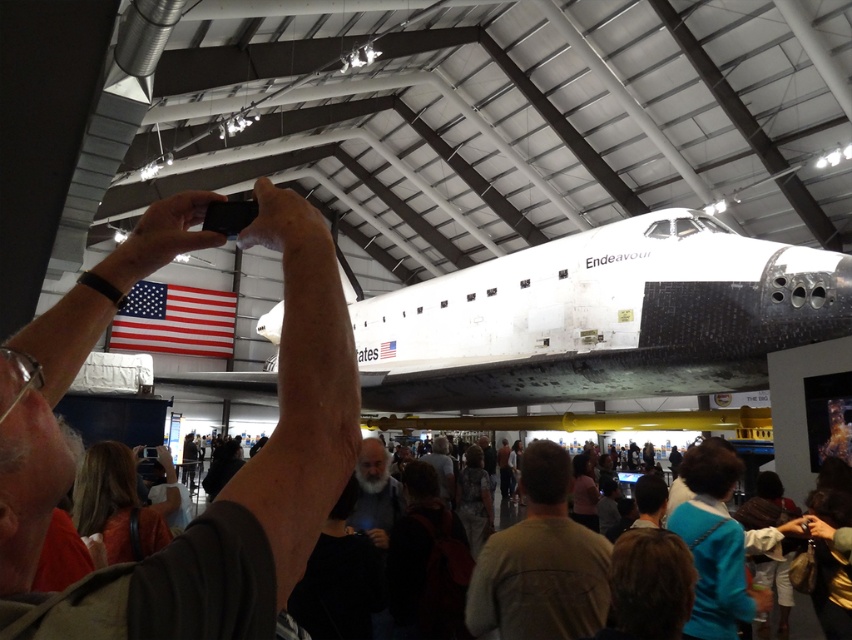
You are a photographer trying to capture the white matte space shuttle at center in your shot. You notice the matte black phone at upper center might block your view. Based on their sizes, can you tell which object is smaller and might be easier to avoid?

The matte black phone at upper center is smaller in height compared to the white matte space shuttle at center, so it might be easier to avoid blocking the shuttle in your photo.

You are a photographer trying to capture the white matte space shuttle at center in your photo. However, there is a matte black phone at upper center blocking your view. Can you adjust your position to avoid the phone while still keeping the shuttle in the frame?

The matte black phone at upper center is positioned over the white matte space shuttle at center. To avoid the phone while keeping the shuttle in frame, you can lower your camera angle slightly so the phone moves out of the shot while the shuttle remains visible.